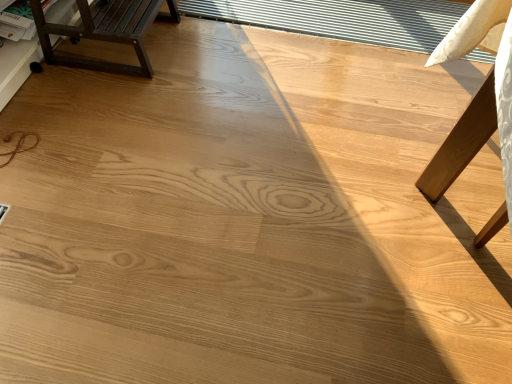
Identify the location of vacant area that is in front of transparent plastic window at upper center. (322, 135).